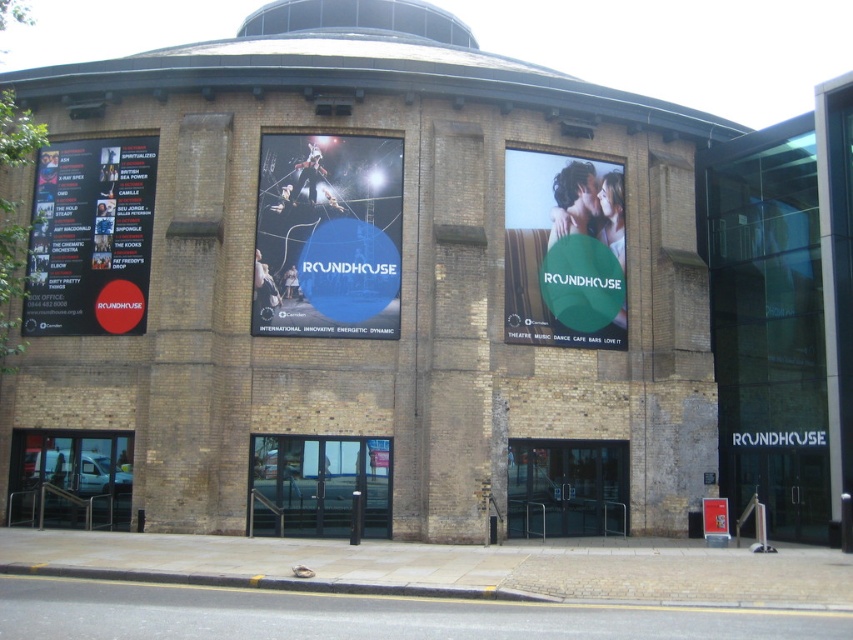
You are standing in front of the Roundhouse building and want to place a new decorative item between the blue glossy poster at center and the matte green sign at center. The item is 2 meters long. Will there be enough space between them to fit the item?

The blue glossy poster at center is 4.55 meters from the matte green sign at center. Since the item is 2 meters long, there is sufficient space between them to accommodate it.

Consider the image. What are the coordinates of the blue glossy poster at center?

The blue glossy poster at center is located at coordinates point (328, 236).